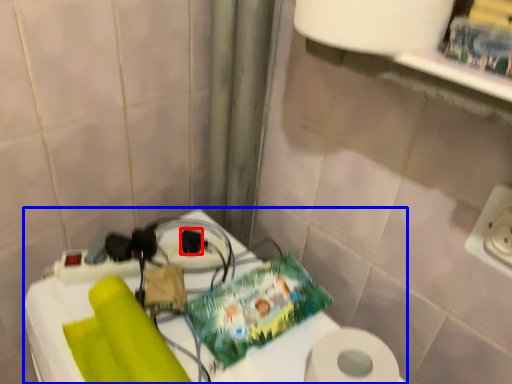
Question: Among these objects, which one is farthest to the camera, socket (highlighted by a red box) or table (highlighted by a blue box)?

Choices:
 (A) socket
 (B) table

Answer: (A)